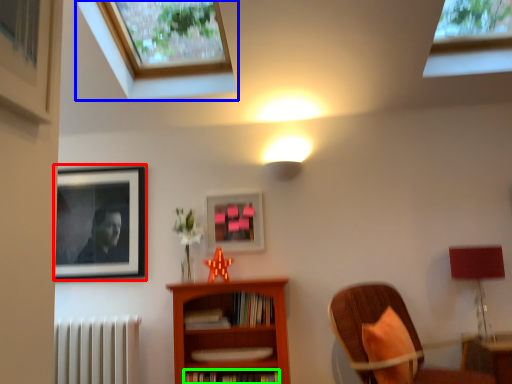
Question: Which is farther away from picture frame (highlighted by a red box)? window (highlighted by a blue box) or book (highlighted by a green box)?

Choices:
 (A) window
 (B) book

Answer: (B)